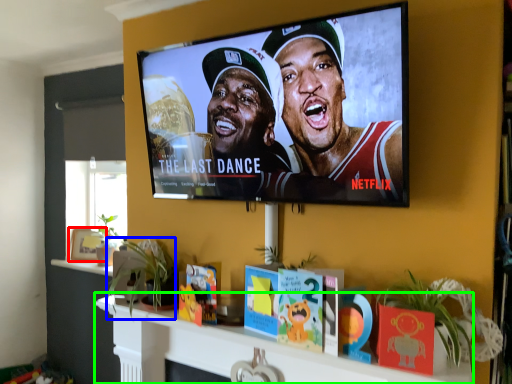
Question: Which object is the farthest from picture frame (highlighted by a red box)? Choose among these: plant (highlighted by a blue box) or shelf (highlighted by a green box).

Choices:
 (A) plant
 (B) shelf

Answer: (B)